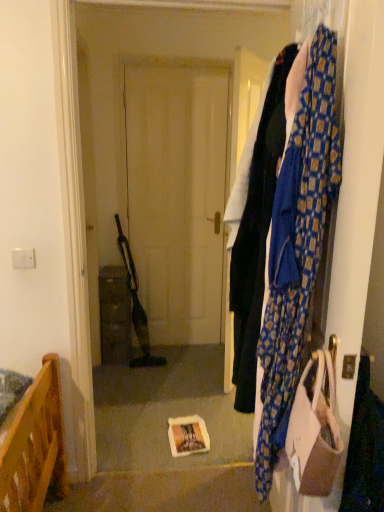
The height and width of the screenshot is (512, 384). What do you see at coordinates (297, 248) in the screenshot?
I see `blue patterned scarf at right` at bounding box center [297, 248].

The image size is (384, 512). What do you see at coordinates (188, 436) in the screenshot? I see `yellow paper book at center` at bounding box center [188, 436].

At what (x,y) coordinates should I click in order to perform the action: click on blue patterned fabric at right. Please return your answer as a coordinate pair (x, y). Looking at the image, I should click on tap(255, 228).

At what (x,y) coordinates should I click in order to perform the action: click on brown matte cabinet at center. Please return your answer as a coordinate pair (x, y). This screenshot has height=512, width=384. Looking at the image, I should click on (114, 315).

The image size is (384, 512). What do you see at coordinates (114, 315) in the screenshot?
I see `brown matte cabinet at center` at bounding box center [114, 315].

The height and width of the screenshot is (512, 384). I want to click on blue patterned scarf at right, so click(x=297, y=248).

From a real-world perspective, which object rests below the other?

beige fabric handbag at right is physically lower.

Is point (291, 435) closer or farther from the camera than point (246, 320)?

Clearly, point (291, 435) is closer to the camera than point (246, 320).

Consider the image. Based on their positions, is beige fabric handbag at right located to the left or right of blue patterned fabric at right?

beige fabric handbag at right is to the right of blue patterned fabric at right.

Which is in front, point (315, 381) or point (201, 440)?

Positioned in front is point (315, 381).

Is beige fabric handbag at right shorter than yellow paper book at center?

No.

From a real-world perspective, is beige fabric handbag at right below yellow paper book at center?

No, from a real-world perspective, beige fabric handbag at right is not below yellow paper book at center.

Would you consider beige fabric handbag at right to be distant from yellow paper book at center?

Yes, beige fabric handbag at right is far from yellow paper book at center.

Is blue patterned scarf at right closer to the viewer compared to beige fabric handbag at right?

No, the depth of blue patterned scarf at right is greater than that of beige fabric handbag at right.

Can you tell me how much blue patterned scarf at right and beige fabric handbag at right differ in facing direction?

The facing directions of blue patterned scarf at right and beige fabric handbag at right are 1.06 degrees apart.

How much distance is there between blue patterned scarf at right and beige fabric handbag at right?

blue patterned scarf at right is 7.50 inches from beige fabric handbag at right.

Between blue patterned scarf at right and beige fabric handbag at right, which one has more height?

blue patterned scarf at right is taller.

Considering their positions, is yellow paper book at center located in front of or behind beige fabric handbag at right?

In the image, yellow paper book at center appears behind beige fabric handbag at right.

Is point (182, 450) positioned before point (336, 420)?

No.

Who is shorter, yellow paper book at center or beige fabric handbag at right?

With less height is yellow paper book at center.

Considering the sizes of objects yellow paper book at center and beige fabric handbag at right in the image provided, who is wider, yellow paper book at center or beige fabric handbag at right?

yellow paper book at center is wider.

Looking at this image, is blue patterned scarf at right beside blue patterned fabric at right?

There is a gap between blue patterned scarf at right and blue patterned fabric at right.

Based on their sizes in the image, would you say blue patterned scarf at right is bigger or smaller than blue patterned fabric at right?

In the image, blue patterned scarf at right appears to be larger than blue patterned fabric at right.

What's the angular difference between blue patterned scarf at right and blue patterned fabric at right's facing directions?

0.466 degrees.

From a real-world perspective, who is located lower, blue patterned scarf at right or blue patterned fabric at right?

From a 3D spatial view, blue patterned scarf at right is below.

Is beige fabric handbag at right aimed at blue patterned scarf at right?

No, beige fabric handbag at right does not turn towards blue patterned scarf at right.

Considering the relative sizes of beige fabric handbag at right and blue patterned scarf at right in the image provided, is beige fabric handbag at right taller than blue patterned scarf at right?

No, beige fabric handbag at right is not taller than blue patterned scarf at right.

Does point (323, 420) come behind point (264, 331)?

No, it is not.

Where is `scarf on the right of brown matte cabinet at center`? The width and height of the screenshot is (384, 512). scarf on the right of brown matte cabinet at center is located at coordinates (297, 248).

Could you tell me if brown matte cabinet at center is turned towards blue patterned scarf at right?

No, brown matte cabinet at center does not turn towards blue patterned scarf at right.

Considering the sizes of objects brown matte cabinet at center and blue patterned scarf at right in the image provided, who is smaller, brown matte cabinet at center or blue patterned scarf at right?

With smaller size is blue patterned scarf at right.

You are a GUI agent. You are given a task and a screenshot of the screen. Output one action in this format:
    pyautogui.click(x=<x>, y=<y>)
    Task: Click on the handbag located underneath the blue patterned fabric at right (from a real-world perspective)
    This screenshot has width=384, height=512.
    Given the screenshot: What is the action you would take?
    pyautogui.click(x=314, y=431)

The width and height of the screenshot is (384, 512). What are the coordinates of `handbag located in front of the yellow paper book at center` in the screenshot? It's located at [x=314, y=431].

Estimate the real-world distances between objects in this image. Which object is closer to brown matte cabinet at center, beige fabric handbag at right or blue patterned fabric at right?

blue patterned fabric at right is closer to brown matte cabinet at center.

From the picture: Which object lies further to the anchor point beige fabric handbag at right, brown matte cabinet at center or blue patterned scarf at right?

brown matte cabinet at center is positioned further to the anchor beige fabric handbag at right.

Considering their positions, is blue patterned fabric at right positioned further to brown matte cabinet at center than yellow paper book at center?

blue patterned fabric at right is further to brown matte cabinet at center.

Estimate the real-world distances between objects in this image. Which object is closer to yellow paper book at center, brown matte cabinet at center or beige fabric handbag at right?

brown matte cabinet at center.

Looking at the image, which one is located further to yellow paper book at center, blue patterned fabric at right or blue patterned scarf at right?

blue patterned scarf at right lies further to yellow paper book at center than the other object.

Based on their spatial positions, is yellow paper book at center or brown matte cabinet at center further from beige fabric handbag at right?

The object further to beige fabric handbag at right is brown matte cabinet at center.

Estimate the real-world distances between objects in this image. Which object is closer to brown matte cabinet at center, blue patterned fabric at right or beige fabric handbag at right?

Based on the image, blue patterned fabric at right appears to be nearer to brown matte cabinet at center.

When comparing their distances from beige fabric handbag at right, does brown matte cabinet at center or yellow paper book at center seem closer?

The object closer to beige fabric handbag at right is yellow paper book at center.

At what (x,y) coordinates should I click in order to perform the action: click on clothing positioned between beige fabric handbag at right and brown matte cabinet at center from near to far. Please return your answer as a coordinate pair (x, y). Looking at the image, I should click on (255, 228).

Locate an element on the screen. The image size is (384, 512). clothing between blue patterned scarf at right and brown matte cabinet at center from front to back is located at coordinates (255, 228).

What are the coordinates of `book positioned between beige fabric handbag at right and brown matte cabinet at center from near to far` in the screenshot? It's located at (188, 436).

Identify the location of scarf between beige fabric handbag at right and brown matte cabinet at center from front to back. The width and height of the screenshot is (384, 512). [297, 248].